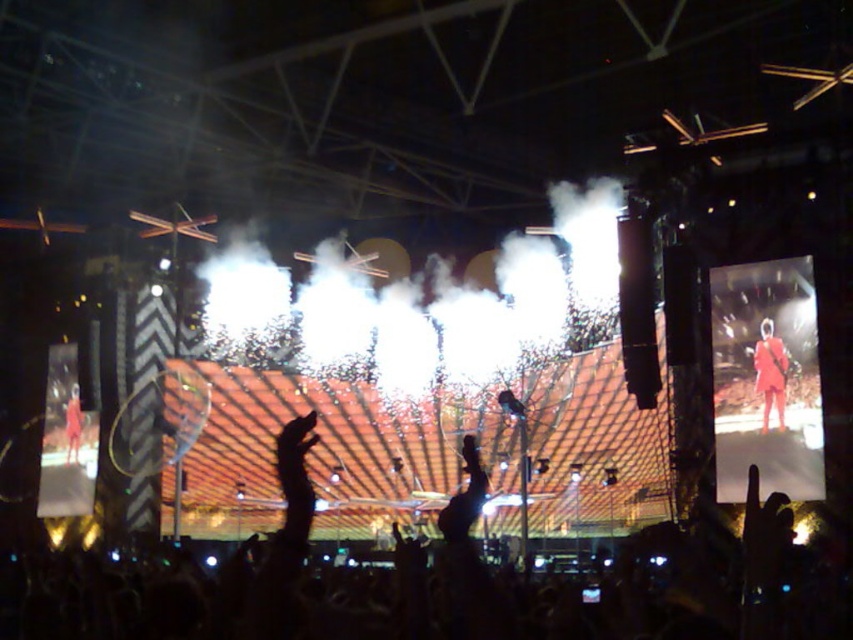
In the scene shown: You are a photographer at the concert and want to capture both the matte red dress at center and the orange fabric person at left in a single frame. Given their sizes, which one should you zoom in on to ensure both fit properly?

The matte red dress at center has a lesser width compared to orange fabric person at left, so you should zoom in on the orange fabric person at left to accommodate its larger size and still include the matte red dress at center in the frame.

You are a photographer at the concert. You want to take a photo that focuses on the matte red dress at center without the black matte hand at center blocking it. Is the hand currently in front of the dress, making it hard to capture the dress clearly?

Yes, the black matte hand at center is closer to the viewer than the matte red dress at center, so it is blocking the dress and making it difficult to capture clearly.

You are a photographer at the concert and want to capture both the black matte hand at center and the orange fabric person at left in a single shot. Given their sizes, which object should you focus on first to ensure both are in frame?

The black matte hand at center is larger in size than the orange fabric person at left, so you should focus on the black matte hand at center first to ensure both are in frame.